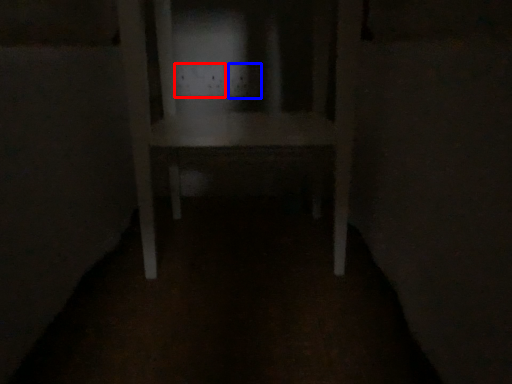
Question: Which point is closer to the camera, electric outlet (highlighted by a red box) or electric outlet (highlighted by a blue box)?

Choices:
 (A) electric outlet
 (B) electric outlet

Answer: (B)